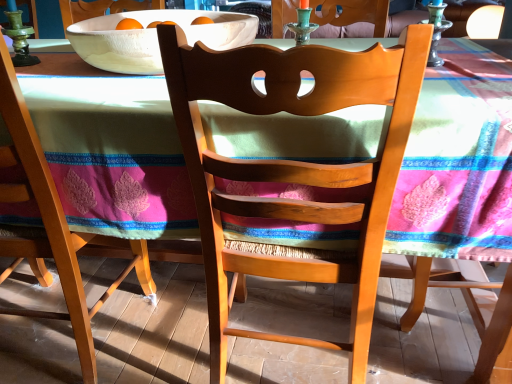
Question: Are white matte bowl at upper center and wooden chair at left, acting as the second chair starting from the right, beside each other?

Choices:
 (A) yes
 (B) no

Answer: (B)

Question: From the image's perspective, would you say white matte bowl at upper center is shown under wooden chair at left, acting as the second chair starting from the right?

Choices:
 (A) no
 (B) yes

Answer: (A)

Question: Does white matte bowl at upper center have a larger size compared to wooden chair at left, which is the first chair in left-to-right order?

Choices:
 (A) yes
 (B) no

Answer: (B)

Question: Is the position of white matte bowl at upper center less distant than that of wooden chair at left, acting as the second chair starting from the right?

Choices:
 (A) no
 (B) yes

Answer: (A)

Question: From a real-world perspective, is white matte bowl at upper center beneath wooden chair at left, which is the first chair in left-to-right order?

Choices:
 (A) no
 (B) yes

Answer: (A)

Question: Is green glass candle holder at upper right, arranged as the 1th candle holder when viewed from the right, inside the boundaries of white matte bowl at upper center, or outside?

Choices:
 (A) inside
 (B) outside

Answer: (B)

Question: Considering the positions of green glass candle holder at upper right, arranged as the 1th candle holder when viewed from the right, and white matte bowl at upper center in the image, is green glass candle holder at upper right, arranged as the 1th candle holder when viewed from the right, wider or thinner than white matte bowl at upper center?

Choices:
 (A) thin
 (B) wide

Answer: (A)

Question: In terms of height, does green glass candle holder at upper right, the second candle holder in the left-to-right sequence, look taller or shorter compared to white matte bowl at upper center?

Choices:
 (A) short
 (B) tall

Answer: (B)

Question: In the image, is green glass candle holder at upper right, arranged as the 1th candle holder when viewed from the right, positioned in front of or behind white matte bowl at upper center?

Choices:
 (A) front
 (B) behind

Answer: (B)

Question: In terms of width, does white matte bowl at upper center look wider or thinner when compared to wooden chair at left, acting as the second chair starting from the right?

Choices:
 (A) wide
 (B) thin

Answer: (A)

Question: Considering the positions of white matte bowl at upper center and wooden chair at left, acting as the second chair starting from the right, in the image, is white matte bowl at upper center bigger or smaller than wooden chair at left, acting as the second chair starting from the right,?

Choices:
 (A) big
 (B) small

Answer: (B)

Question: Choose the correct answer: Is white matte bowl at upper center inside wooden chair at left, which is the first chair in left-to-right order, or outside it?

Choices:
 (A) outside
 (B) inside

Answer: (A)

Question: Considering the positions of point (102, 62) and point (4, 72), is point (102, 62) closer or farther from the camera than point (4, 72)?

Choices:
 (A) farther
 (B) closer

Answer: (A)

Question: Is wooden chair at left, which is the first chair in left-to-right order, situated inside green glass candle holder at upper center, which ranks as the 2th candle holder in right-to-left order, or outside?

Choices:
 (A) outside
 (B) inside

Answer: (A)

Question: Looking at the image, does wooden chair at left, acting as the second chair starting from the right, seem bigger or smaller compared to green glass candle holder at upper center, which ranks as the 2th candle holder in right-to-left order?

Choices:
 (A) big
 (B) small

Answer: (A)